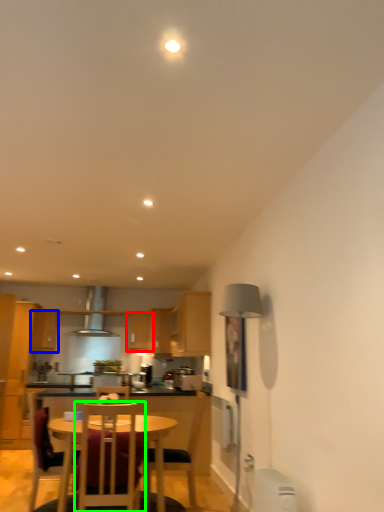
Question: Considering the real-world distances, which object is farthest from cabinetry (highlighted by a red box)? cabinetry (highlighted by a blue box) or chair (highlighted by a green box)?

Choices:
 (A) cabinetry
 (B) chair

Answer: (B)